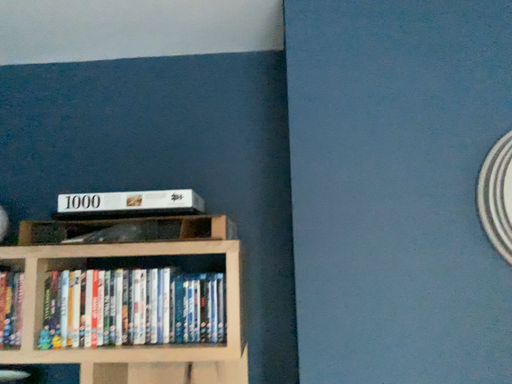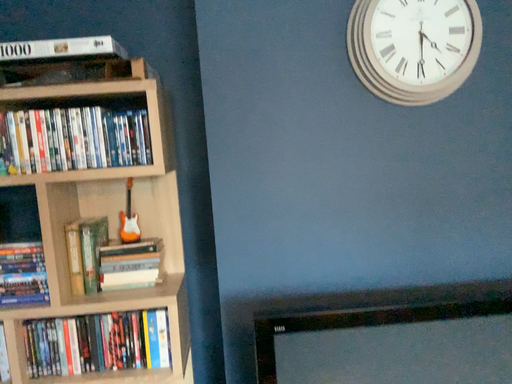
Question: Which way did the camera rotate in the video?

Choices:
 (A) rotated left
 (B) rotated right

Answer: (B)